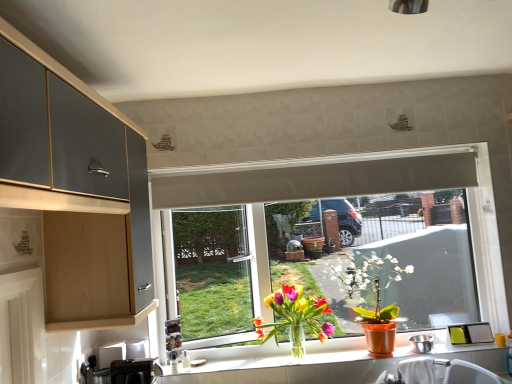
What do you see at coordinates (422, 343) in the screenshot? This screenshot has width=512, height=384. I see `metallic stainless steel bowl at window, which ranks as the 1th appliance in right-to-left order` at bounding box center [422, 343].

I want to click on black plastic toaster at lower left, which ranks as the 2th appliance in back-to-front order, so click(x=125, y=372).

Measure the distance between point (464, 378) and camera.

They are 6.43 feet apart.

The height and width of the screenshot is (384, 512). I want to click on matte gray cabinet at upper left, so click(76, 189).

Is white ceramic sink at lower right spatially inside translucent glass vase at window, the second houseplant in the right-to-left sequence, or outside of it?

white ceramic sink at lower right cannot be found inside translucent glass vase at window, the second houseplant in the right-to-left sequence.

Is white ceramic sink at lower right facing towards translucent glass vase at window, acting as the 1th houseplant starting from the left?

No, white ceramic sink at lower right is not facing towards translucent glass vase at window, acting as the 1th houseplant starting from the left.

Who is smaller, white ceramic sink at lower right or translucent glass vase at window, the second houseplant in the right-to-left sequence?

With smaller size is white ceramic sink at lower right.

Which of these two, white ceramic sink at lower right or translucent glass vase at window, the second houseplant in the right-to-left sequence, stands shorter?

white ceramic sink at lower right is shorter.

From the image's perspective, is black plastic toaster at lower left, acting as the first appliance starting from the left, beneath matte gray cabinet at upper left?

Yes, from the image's perspective, black plastic toaster at lower left, acting as the first appliance starting from the left, is beneath matte gray cabinet at upper left.

Does black plastic toaster at lower left, which ranks as the 2th appliance in back-to-front order, appear on the left side of matte gray cabinet at upper left?

Incorrect, black plastic toaster at lower left, which ranks as the 2th appliance in back-to-front order, is not on the left side of matte gray cabinet at upper left.

Who is shorter, black plastic toaster at lower left, acting as the 1th appliance starting from the front, or matte gray cabinet at upper left?

With less height is black plastic toaster at lower left, acting as the 1th appliance starting from the front.

Which of these two, black plastic toaster at lower left, which ranks as the 2th appliance in back-to-front order, or matte gray cabinet at upper left, is bigger?

Bigger between the two is matte gray cabinet at upper left.

From the image's perspective, which one is positioned higher, metallic stainless steel bowl at window, the first appliance from the back, or white matte exhaust hood at upper center?

white matte exhaust hood at upper center.

Does metallic stainless steel bowl at window, the first appliance from the back, have a greater width compared to white matte exhaust hood at upper center?

Indeed, metallic stainless steel bowl at window, the first appliance from the back, has a greater width compared to white matte exhaust hood at upper center.

Considering the relative positions of metallic stainless steel bowl at window, which ranks as the 1th appliance in right-to-left order, and white matte exhaust hood at upper center in the image provided, is metallic stainless steel bowl at window, which ranks as the 1th appliance in right-to-left order, to the left of white matte exhaust hood at upper center from the viewer's perspective?

No.

Between metallic stainless steel bowl at window, which appears as the second appliance when viewed from the left, and white matte exhaust hood at upper center, which one has smaller size?

Smaller between the two is metallic stainless steel bowl at window, which appears as the second appliance when viewed from the left.

Consider the image. From the image's perspective, which object appears higher, translucent glass vase at window, the second houseplant in the right-to-left sequence, or matte gray cabinet at upper left?

From the image's view, matte gray cabinet at upper left is above.

In order to click on cabinetry lying on the left of translucent glass vase at window, acting as the 1th houseplant starting from the left in this screenshot , I will do `click(76, 189)`.

Is translucent glass vase at window, acting as the 1th houseplant starting from the left, with matte gray cabinet at upper left?

No, translucent glass vase at window, acting as the 1th houseplant starting from the left, is not touching matte gray cabinet at upper left.

Can you tell me how much matte gray cabinet at upper left and white ceramic sink at lower right differ in facing direction?

There is a 89.2-degree angle between the facing directions of matte gray cabinet at upper left and white ceramic sink at lower right.

Is matte gray cabinet at upper left inside or outside of white ceramic sink at lower right?

The correct answer is: outside.

Between matte gray cabinet at upper left and white ceramic sink at lower right, which one has smaller width?

With smaller width is matte gray cabinet at upper left.

Which is less distant, (7, 127) or (420, 369)?

The point (7, 127) is closer.

Can you tell me how much white matte window at center and white ceramic sink at lower right differ in facing direction?

There is a 0.784-degree angle between the facing directions of white matte window at center and white ceramic sink at lower right.

Which object is wider, white matte window at center or white ceramic sink at lower right?

With larger width is white ceramic sink at lower right.

Can you confirm if white matte window at center is bigger than white ceramic sink at lower right?

Indeed, white matte window at center has a larger size compared to white ceramic sink at lower right.

Between white matte window at center and white ceramic sink at lower right, which one is positioned in front?

white ceramic sink at lower right.

From a real-world perspective, does matte gray cabinet at upper left sit lower than translucent glass vase at window, acting as the 1th houseplant starting from the left?

Actually, matte gray cabinet at upper left is physically above translucent glass vase at window, acting as the 1th houseplant starting from the left, in the real world.

Is matte gray cabinet at upper left positioned with its back to translucent glass vase at window, the second houseplant in the right-to-left sequence?

No, matte gray cabinet at upper left's orientation is not away from translucent glass vase at window, the second houseplant in the right-to-left sequence.

Between matte gray cabinet at upper left and translucent glass vase at window, the second houseplant in the right-to-left sequence, which one has less height?

With less height is translucent glass vase at window, the second houseplant in the right-to-left sequence.

From the image's perspective, is matte gray cabinet at upper left positioned above or below translucent glass vase at window, the second houseplant in the right-to-left sequence?

Based on their image positions, matte gray cabinet at upper left is located above translucent glass vase at window, the second houseplant in the right-to-left sequence.

Starting from the white ceramic sink at lower right, which houseplant is the 2nd one to the left? Please provide its 2D coordinates.

[(295, 317)]

There is a black plastic toaster at lower left, acting as the 1th appliance starting from the front. In order to click on cabinetry above it (from a real-world perspective) in this screenshot , I will do `click(76, 189)`.

Which object lies further to the anchor point metallic stainless steel bowl at window, which ranks as the 1th appliance in right-to-left order, translucent glass vase at lower center or white matte exhaust hood at upper center?

white matte exhaust hood at upper center is further to metallic stainless steel bowl at window, which ranks as the 1th appliance in right-to-left order.

Based on the photo, when comparing their distances from metallic stainless steel bowl at window, marked as the 2th appliance in a front-to-back arrangement, does white ceramic sink at lower right or matte gray cabinet at upper left seem closer?

Among the two, white ceramic sink at lower right is located nearer to metallic stainless steel bowl at window, marked as the 2th appliance in a front-to-back arrangement.

Looking at the image, which one is located closer to matte gray cabinet at upper left, white matte window at center or white ceramic sink at lower right?

white matte window at center is positioned closer to the anchor matte gray cabinet at upper left.

Looking at the image, which one is located closer to translucent glass vase at window, acting as the 1th houseplant starting from the left, matte gray cabinet at upper left or metallic stainless steel bowl at window, which ranks as the 1th appliance in right-to-left order?

metallic stainless steel bowl at window, which ranks as the 1th appliance in right-to-left order, is closer to translucent glass vase at window, acting as the 1th houseplant starting from the left.

Which object lies nearer to the anchor point translucent glass vase at window, the second houseplant in the right-to-left sequence, white ceramic sink at lower right or translucent glass vase at lower center?

translucent glass vase at lower center lies closer to translucent glass vase at window, the second houseplant in the right-to-left sequence, than the other object.

Considering their positions, is white ceramic sink at lower right positioned further to metallic stainless steel bowl at window, the first appliance from the back, than white matte exhaust hood at upper center?

Based on the image, white matte exhaust hood at upper center appears to be further to metallic stainless steel bowl at window, the first appliance from the back.

Estimate the real-world distances between objects in this image. Which object is closer to metallic stainless steel bowl at window, which appears as the second appliance when viewed from the left, translucent glass vase at window, the second houseplant in the right-to-left sequence, or white matte window at center?

Based on the image, translucent glass vase at window, the second houseplant in the right-to-left sequence, appears to be nearer to metallic stainless steel bowl at window, which appears as the second appliance when viewed from the left.

When comparing their distances from white matte exhaust hood at upper center, does white matte window at center or white ceramic sink at lower right seem further?

Among the two, white ceramic sink at lower right is located further to white matte exhaust hood at upper center.

Image resolution: width=512 pixels, height=384 pixels. Find the location of `window between white matte exhaust hood at upper center and matte orange pot at window, the first houseplant from the right, vertically`. window between white matte exhaust hood at upper center and matte orange pot at window, the first houseplant from the right, vertically is located at coordinates (374, 160).

Identify the location of countertop between translucent glass vase at window, acting as the 1th houseplant starting from the left, and matte orange pot at window, the first houseplant from the right, in the horizontal direction. Image resolution: width=512 pixels, height=384 pixels. (288, 367).

Find the location of a particular element. This screenshot has height=384, width=512. houseplant located between translucent glass vase at window, the second houseplant in the right-to-left sequence, and white ceramic sink at lower right in the left-right direction is located at coordinates (376, 302).

Identify the location of exhaust hood located between black plastic toaster at lower left, which ranks as the 2th appliance in back-to-front order, and white matte window at center in the left-right direction. This screenshot has height=384, width=512. (314, 178).